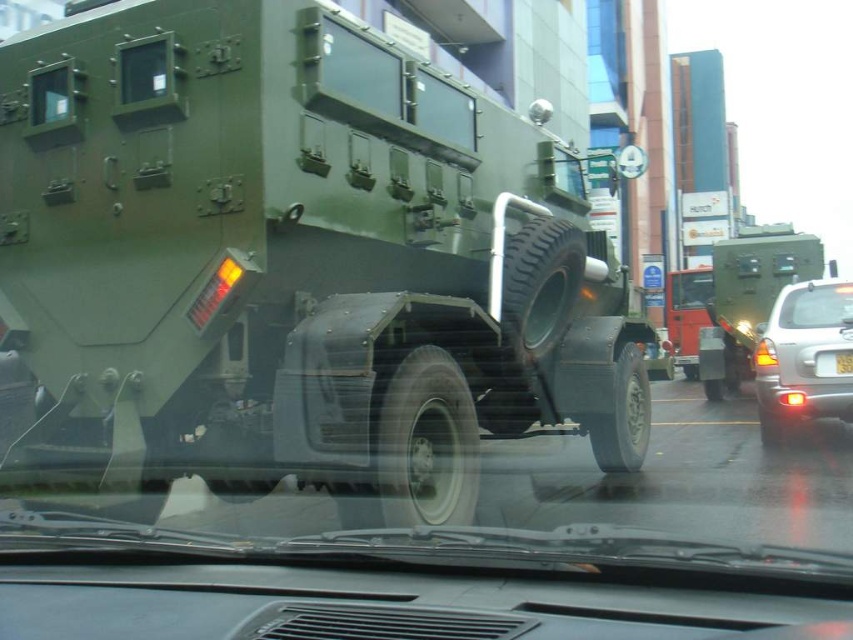
Which is in front, point (67, 349) or point (848, 310)?

Positioned in front is point (67, 349).

Based on the photo, who is positioned more to the right, matte green tank at center or transparent glass windshield at center?

From the viewer's perspective, transparent glass windshield at center appears more on the right side.

Where is `matte green tank at center`? matte green tank at center is located at coordinates (292, 262).

Can you confirm if silver metallic car at right is thinner than transparent glass windshield at center?

In fact, silver metallic car at right might be wider than transparent glass windshield at center.

Is silver metallic car at right closer to camera compared to transparent glass windshield at center?

Yes.

The image size is (853, 640). Describe the element at coordinates (804, 356) in the screenshot. I see `silver metallic car at right` at that location.

What are the coordinates of `silver metallic car at right` in the screenshot? It's located at click(x=804, y=356).

The image size is (853, 640). What do you see at coordinates (292, 262) in the screenshot?
I see `matte green tank at center` at bounding box center [292, 262].

Find the location of a particular element. matte green tank at center is located at coordinates (292, 262).